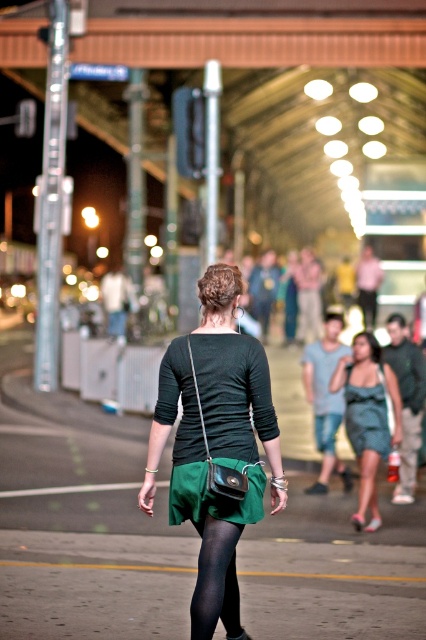
Is black tights at center bigger than teal satin dress at center?

No, black tights at center is not bigger than teal satin dress at center.

Which of these two, black tights at center or teal satin dress at center, stands taller?

Standing taller between the two is teal satin dress at center.

What do you see at coordinates (215, 579) in the screenshot?
I see `black tights at center` at bounding box center [215, 579].

Locate an element on the screen. black tights at center is located at coordinates (215, 579).

Which is below, matte green dress at center or black tights at center?

black tights at center is below.

Which is in front, point (348, 436) or point (198, 632)?

Point (198, 632)

Locate an element on the screen. matte green dress at center is located at coordinates (368, 417).

Is matte green dress at center to the right of teal satin dress at center from the viewer's perspective?

Incorrect, matte green dress at center is not on the right side of teal satin dress at center.

Is point (367, 493) positioned in front of point (356, 422)?

Yes, point (367, 493) is in front of point (356, 422).

Find the location of `matte green dress at center`. matte green dress at center is located at coordinates (368, 417).